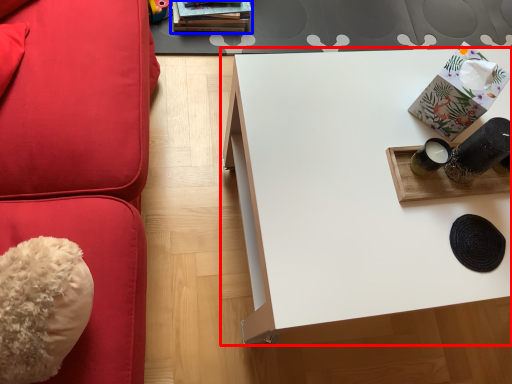
Question: Which point is closer to the camera, table (highlighted by a red box) or book (highlighted by a blue box)?

Choices:
 (A) table
 (B) book

Answer: (A)